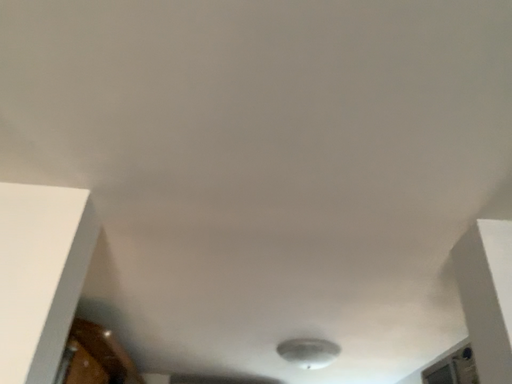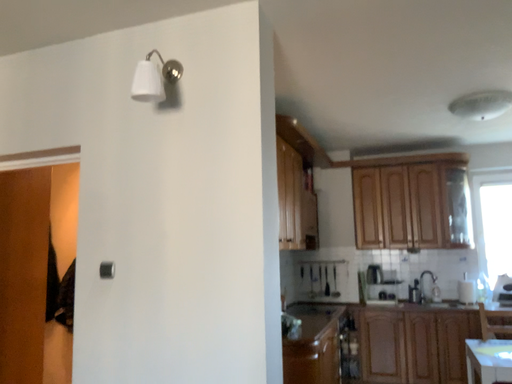
Question: Which way did the camera rotate in the video?

Choices:
 (A) rotated right
 (B) rotated left

Answer: (B)